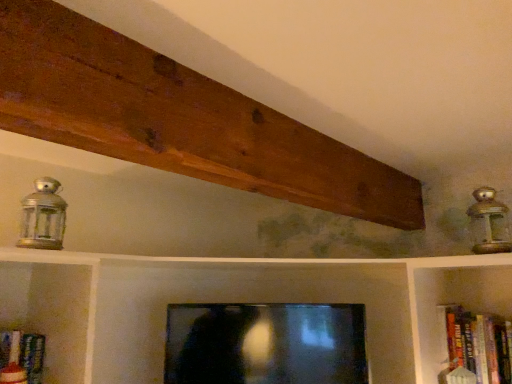
Question: Considering the relative sizes of metallic lantern at upper right, which ranks as the first lamp in right-to-left order, and brown wood plank at upper center in the image provided, is metallic lantern at upper right, which ranks as the first lamp in right-to-left order, bigger than brown wood plank at upper center?

Choices:
 (A) yes
 (B) no

Answer: (B)

Question: Could you tell me if metallic lantern at upper right, which ranks as the first lamp in right-to-left order, is turned towards brown wood plank at upper center?

Choices:
 (A) yes
 (B) no

Answer: (B)

Question: Is metallic lantern at upper right, which ranks as the first lamp in right-to-left order, positioned behind brown wood plank at upper center?

Choices:
 (A) yes
 (B) no

Answer: (A)

Question: Can you confirm if metallic lantern at upper right, which is the 2th lamp in left-to-right order, is shorter than brown wood plank at upper center?

Choices:
 (A) yes
 (B) no

Answer: (B)

Question: Does metallic lantern at upper right, which ranks as the first lamp in right-to-left order, appear on the left side of brown wood plank at upper center?

Choices:
 (A) no
 (B) yes

Answer: (A)

Question: Based on their sizes in the image, would you say hardcover book at right is bigger or smaller than matte black tv at center?

Choices:
 (A) big
 (B) small

Answer: (B)

Question: Which is correct: hardcover book at right is inside matte black tv at center, or outside of it?

Choices:
 (A) inside
 (B) outside

Answer: (B)

Question: From their relative heights in the image, would you say hardcover book at right is taller or shorter than matte black tv at center?

Choices:
 (A) tall
 (B) short

Answer: (B)

Question: Is hardcover book at right wider or thinner than matte black tv at center?

Choices:
 (A) wide
 (B) thin

Answer: (B)

Question: Considering the positions of silver metallic lantern at left, the 2th lamp positioned from the right, and brown wood plank at upper center in the image, is silver metallic lantern at left, the 2th lamp positioned from the right, wider or thinner than brown wood plank at upper center?

Choices:
 (A) wide
 (B) thin

Answer: (B)

Question: From a real-world perspective, relative to brown wood plank at upper center, is silver metallic lantern at left, the 2th lamp positioned from the right, vertically above or below?

Choices:
 (A) below
 (B) above

Answer: (A)

Question: From the image's perspective, relative to brown wood plank at upper center, is silver metallic lantern at left, which is counted as the first lamp, starting from the left, above or below?

Choices:
 (A) below
 (B) above

Answer: (A)

Question: Based on their positions, is silver metallic lantern at left, the 2th lamp positioned from the right, located to the left or right of brown wood plank at upper center?

Choices:
 (A) right
 (B) left

Answer: (B)

Question: Is point (409, 185) closer or farther from the camera than point (54, 193)?

Choices:
 (A) farther
 (B) closer

Answer: (A)

Question: Considering the relative positions of brown wood plank at upper center and silver metallic lantern at left, which is counted as the first lamp, starting from the left, in the image provided, is brown wood plank at upper center to the left or to the right of silver metallic lantern at left, which is counted as the first lamp, starting from the left,?

Choices:
 (A) right
 (B) left

Answer: (A)